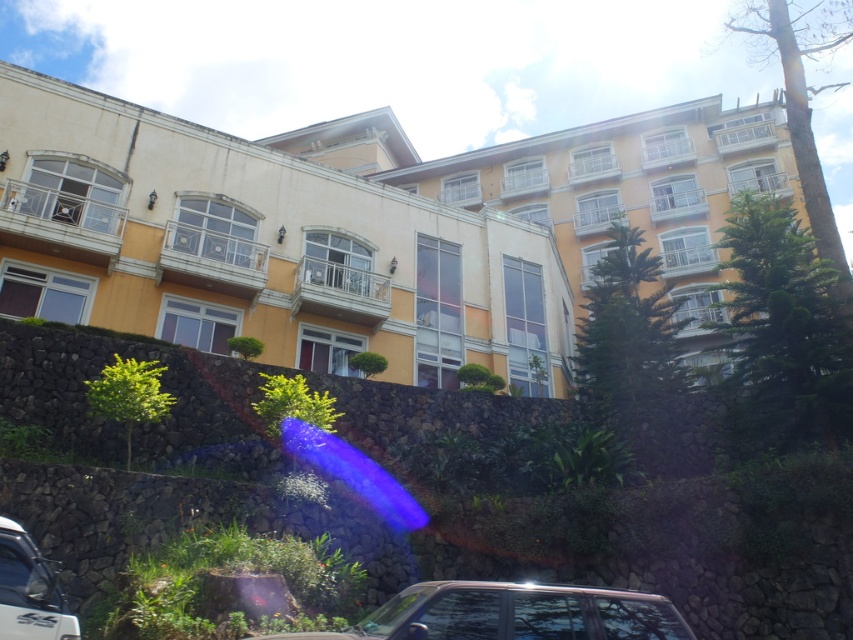
Between shiny silver car at lower center and white glossy car at lower left, which one appears on the left side from the viewer's perspective?

Positioned to the left is white glossy car at lower left.

Is point (531, 612) positioned in front of point (10, 563)?

Yes, it is.

The width and height of the screenshot is (853, 640). I want to click on shiny silver car at lower center, so click(x=512, y=612).

Is point (434, 227) closer to viewer compared to point (42, 595)?

No, it is behind (42, 595).

Can you confirm if yellow matte building at center is shorter than white glossy car at lower left?

No, yellow matte building at center is not shorter than white glossy car at lower left.

Between point (314, 172) and point (67, 632), which one is positioned in front?

Point (67, 632)

Find the location of `yellow matte building at center`. yellow matte building at center is located at coordinates (263, 244).

Is point (234, 250) in front of point (123, 552)?

No, it is not.

In the scene shown: Can you confirm if yellow matte building at center is positioned above green leafy shrubs at lower center?

Yes, yellow matte building at center is above green leafy shrubs at lower center.

Measure the distance between yellow matte building at center and camera.

yellow matte building at center and camera are 21.99 meters apart from each other.

This screenshot has width=853, height=640. I want to click on yellow matte building at center, so click(x=263, y=244).